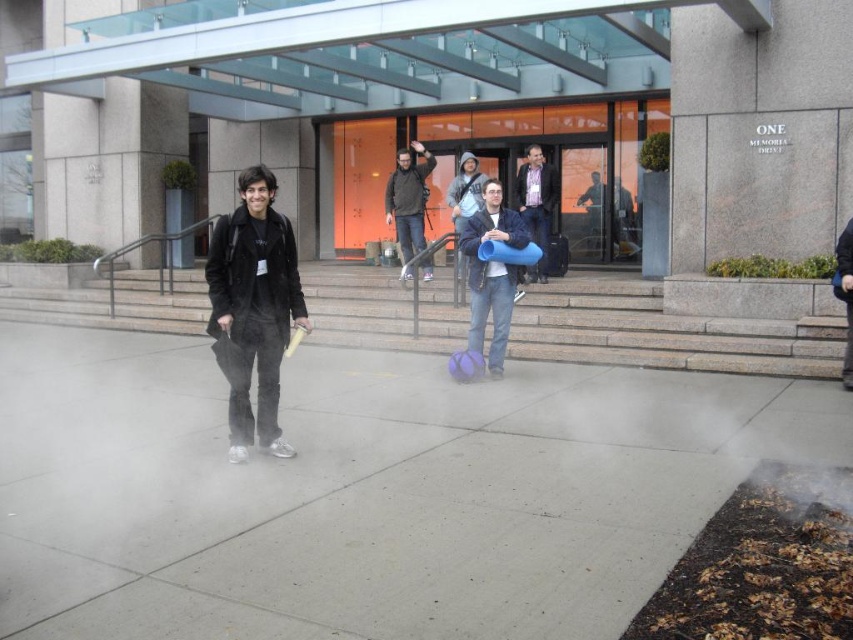
Question: Considering the real-world distances, which object is farthest from the blue fabric bag at center?

Choices:
 (A) dark gray backpack at center
 (B) gray concrete pavement at center

Answer: (B)

Question: Is gray concrete pavement at center wider than black fuzzy coat at center?

Choices:
 (A) no
 (B) yes

Answer: (B)

Question: Observing the image, what is the correct spatial positioning of gray concrete stairs at center in reference to black fuzzy coat at center?

Choices:
 (A) right
 (B) left

Answer: (B)

Question: Among these objects, which one is farthest from the camera?

Choices:
 (A) blue fabric bag at center
 (B) gray concrete stairs at center

Answer: (A)

Question: Can you confirm if gray concrete stairs at center is positioned to the right of black fuzzy coat at center?

Choices:
 (A) no
 (B) yes

Answer: (A)

Question: Estimate the real-world distances between objects in this image. Which object is closer to the blue rubber tube at center?

Choices:
 (A) gray concrete pavement at center
 (B) black fuzzy coat at center
 (C) dark gray backpack at center
 (D) blue rubber mat at center

Answer: (C)